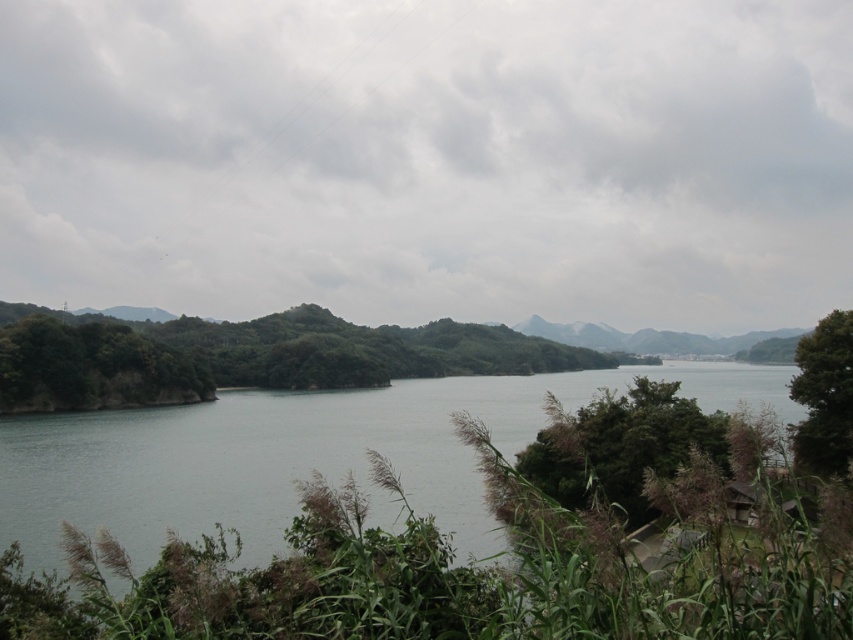
Question: Which object is the closest to the green leafy shrubs at left?

Choices:
 (A) green leafy tree at right
 (B) gray water at center

Answer: (B)

Question: Among these points, which one is nearest to the camera?

Choices:
 (A) (x=15, y=380)
 (B) (x=816, y=372)
 (C) (x=120, y=490)

Answer: (B)

Question: Does green leafy shrubs at left appear on the right side of green leafy tree at right?

Choices:
 (A) yes
 (B) no

Answer: (B)

Question: Which of these objects is positioned closest to the green leafy shrubs at left?

Choices:
 (A) gray water at center
 (B) green leafy tree at right

Answer: (A)

Question: Does gray water at center have a larger size compared to green leafy tree at right?

Choices:
 (A) no
 (B) yes

Answer: (B)

Question: Does gray water at center appear on the right side of green leafy tree at right?

Choices:
 (A) yes
 (B) no

Answer: (A)